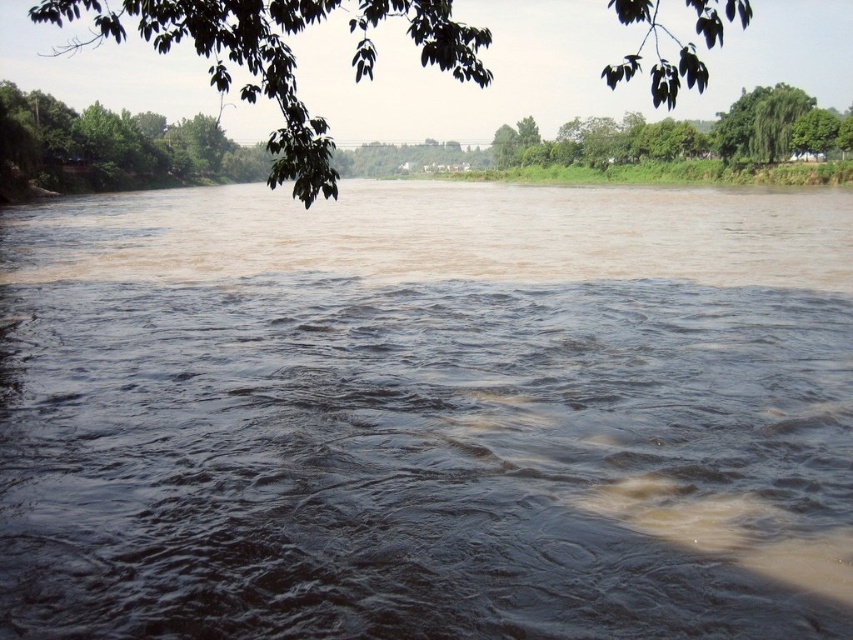
Question: Which point is closer to the camera taking this photo?

Choices:
 (A) (189, 531)
 (B) (201, 10)

Answer: (A)

Question: Which of the following is the closest to the observer?

Choices:
 (A) green leafy tree at upper center
 (B) brown muddy water at center

Answer: (B)

Question: Which point is farther from the camera taking this photo?

Choices:
 (A) (624, 1)
 (B) (86, 380)

Answer: (B)

Question: Is brown muddy water at center above green leafy tree at upper center?

Choices:
 (A) no
 (B) yes

Answer: (A)

Question: Is brown muddy water at center thinner than green leafy tree at upper center?

Choices:
 (A) no
 (B) yes

Answer: (B)

Question: Can you confirm if brown muddy water at center is bigger than green leafy tree at upper center?

Choices:
 (A) yes
 (B) no

Answer: (B)